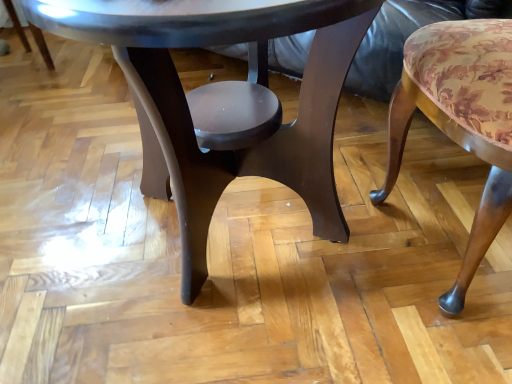
At what (x,y) coordinates should I click in order to perform the action: click on vacant space behind floral fabric cushion at right. Please return your answer as a coordinate pair (x, y). The height and width of the screenshot is (384, 512). Looking at the image, I should click on (401, 155).